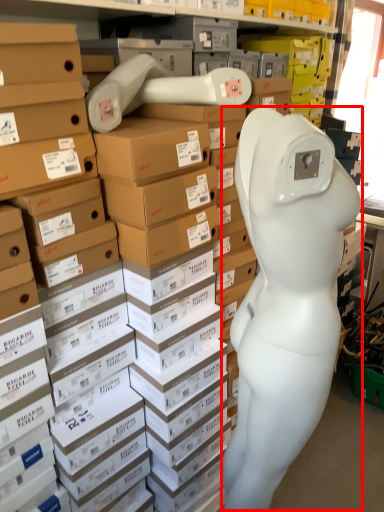
Question: From the image's perspective, where is worker (annotated by the red box) located in relation to head in the image?

Choices:
 (A) below
 (B) above

Answer: (A)